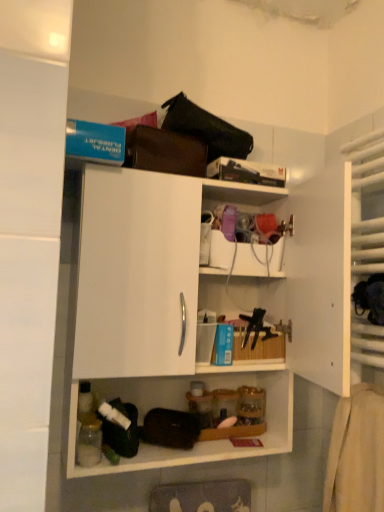
Locate an element on the screen. The image size is (384, 512). white matte cabinet at center, which is counted as the 1th shelf, starting from the left is located at coordinates (156, 304).

Describe the element at coordinates (156, 304) in the screenshot. I see `white matte cabinet at center, which is counted as the 1th shelf, starting from the left` at that location.

Image resolution: width=384 pixels, height=512 pixels. In order to click on translucent plastic container at upper center, which is counted as the first shelf, starting from the right in this screenshot , I will do `click(247, 256)`.

What do you see at coordinates (247, 256) in the screenshot? I see `translucent plastic container at upper center, which is counted as the first shelf, starting from the right` at bounding box center [247, 256].

Locate an element on the screen. The image size is (384, 512). white matte cabinet at center, which is counted as the 1th shelf, starting from the left is located at coordinates (156, 304).

Considering the relative positions of translucent plastic container at upper center, which is counted as the first shelf, starting from the right, and white matte cabinet at center, which is counted as the 1th shelf, starting from the left, in the image provided, is translucent plastic container at upper center, which is counted as the first shelf, starting from the right, to the left of white matte cabinet at center, which is counted as the 1th shelf, starting from the left, from the viewer's perspective?

No.

Relative to white matte cabinet at center, which is counted as the 2th shelf, starting from the right, is translucent plastic container at upper center, which is counted as the first shelf, starting from the right, in front or behind?

translucent plastic container at upper center, which is counted as the first shelf, starting from the right, is behind white matte cabinet at center, which is counted as the 2th shelf, starting from the right.

Which point is more forward, (219, 261) or (165, 271)?

The point (165, 271) is more forward.

From the image's perspective, who appears lower, translucent plastic container at upper center, which is counted as the first shelf, starting from the right, or white matte cabinet at center, which is counted as the 1th shelf, starting from the left?

white matte cabinet at center, which is counted as the 1th shelf, starting from the left, is shown below in the image.

From a real-world perspective, is translucent plastic container at upper center, positioned as the second shelf in left-to-right order, physically below white matte cabinet at center, which is counted as the 1th shelf, starting from the left?

Actually, translucent plastic container at upper center, positioned as the second shelf in left-to-right order, is physically above white matte cabinet at center, which is counted as the 1th shelf, starting from the left, in the real world.

Which of these two, translucent plastic container at upper center, which is counted as the first shelf, starting from the right, or white matte cabinet at center, which is counted as the 2th shelf, starting from the right, is thinner?

With smaller width is translucent plastic container at upper center, which is counted as the first shelf, starting from the right.

In terms of height, does translucent plastic container at upper center, which is counted as the first shelf, starting from the right, look taller or shorter compared to white matte cabinet at center, which is counted as the 1th shelf, starting from the left?

In the image, translucent plastic container at upper center, which is counted as the first shelf, starting from the right, appears to be shorter than white matte cabinet at center, which is counted as the 1th shelf, starting from the left.

Considering the relative sizes of translucent plastic container at upper center, which is counted as the first shelf, starting from the right, and white matte cabinet at center, which is counted as the 2th shelf, starting from the right, in the image provided, is translucent plastic container at upper center, which is counted as the first shelf, starting from the right, bigger than white matte cabinet at center, which is counted as the 2th shelf, starting from the right,?

Incorrect, translucent plastic container at upper center, which is counted as the first shelf, starting from the right, is not larger than white matte cabinet at center, which is counted as the 2th shelf, starting from the right.

Choose the correct answer: Is translucent plastic container at upper center, which is counted as the first shelf, starting from the right, inside white matte cabinet at center, which is counted as the 1th shelf, starting from the left, or outside it?

translucent plastic container at upper center, which is counted as the first shelf, starting from the right, is spatially positioned inside white matte cabinet at center, which is counted as the 1th shelf, starting from the left.

Is translucent plastic container at upper center, positioned as the second shelf in left-to-right order, in contact with white matte cabinet at center, which is counted as the 2th shelf, starting from the right?

translucent plastic container at upper center, positioned as the second shelf in left-to-right order, is not next to white matte cabinet at center, which is counted as the 2th shelf, starting from the right, and they're not touching.

Could you tell me if translucent plastic container at upper center, positioned as the second shelf in left-to-right order, is facing white matte cabinet at center, which is counted as the 2th shelf, starting from the right?

Yes, translucent plastic container at upper center, positioned as the second shelf in left-to-right order, is facing white matte cabinet at center, which is counted as the 2th shelf, starting from the right.

You are a GUI agent. You are given a task and a screenshot of the screen. Output one action in this format:
    pyautogui.click(x=<x>, y=<y>)
    Task: Click on the shelf below the translucent plastic container at upper center, which is counted as the first shelf, starting from the right (from the image's perspective)
    The height and width of the screenshot is (512, 384).
    Given the screenshot: What is the action you would take?
    pyautogui.click(x=156, y=304)

Which object is positioned more to the right, white matte cabinet at center, which is counted as the 1th shelf, starting from the left, or translucent plastic container at upper center, positioned as the second shelf in left-to-right order?

translucent plastic container at upper center, positioned as the second shelf in left-to-right order, is more to the right.

Considering the positions of objects white matte cabinet at center, which is counted as the 2th shelf, starting from the right, and translucent plastic container at upper center, positioned as the second shelf in left-to-right order, in the image provided, who is behind, white matte cabinet at center, which is counted as the 2th shelf, starting from the right, or translucent plastic container at upper center, positioned as the second shelf in left-to-right order,?

Positioned behind is translucent plastic container at upper center, positioned as the second shelf in left-to-right order.

Based on the photo, which point is more distant from viewer, (167, 285) or (258, 190)?

Point (258, 190)

From the image's perspective, is white matte cabinet at center, which is counted as the 2th shelf, starting from the right, over translucent plastic container at upper center, positioned as the second shelf in left-to-right order?

No, from the image's perspective, white matte cabinet at center, which is counted as the 2th shelf, starting from the right, is not on top of translucent plastic container at upper center, positioned as the second shelf in left-to-right order.

From a real-world perspective, which is physically above, white matte cabinet at center, which is counted as the 2th shelf, starting from the right, or translucent plastic container at upper center, positioned as the second shelf in left-to-right order?

translucent plastic container at upper center, positioned as the second shelf in left-to-right order, from a real-world perspective.

Looking at this image, between white matte cabinet at center, which is counted as the 2th shelf, starting from the right, and translucent plastic container at upper center, positioned as the second shelf in left-to-right order, which one has smaller width?

Thinner between the two is translucent plastic container at upper center, positioned as the second shelf in left-to-right order.

Is white matte cabinet at center, which is counted as the 2th shelf, starting from the right, shorter than translucent plastic container at upper center, which is counted as the first shelf, starting from the right?

Incorrect, the height of white matte cabinet at center, which is counted as the 2th shelf, starting from the right, does not fall short of that of translucent plastic container at upper center, which is counted as the first shelf, starting from the right.

Between white matte cabinet at center, which is counted as the 1th shelf, starting from the left, and translucent plastic container at upper center, positioned as the second shelf in left-to-right order, which one has larger size?

Bigger between the two is white matte cabinet at center, which is counted as the 1th shelf, starting from the left.

Which is correct: white matte cabinet at center, which is counted as the 1th shelf, starting from the left, is inside translucent plastic container at upper center, positioned as the second shelf in left-to-right order, or outside of it?

white matte cabinet at center, which is counted as the 1th shelf, starting from the left, is spatially situated outside translucent plastic container at upper center, positioned as the second shelf in left-to-right order.

Is white matte cabinet at center, which is counted as the 2th shelf, starting from the right, next to translucent plastic container at upper center, which is counted as the first shelf, starting from the right, and touching it?

No, white matte cabinet at center, which is counted as the 2th shelf, starting from the right, is not making contact with translucent plastic container at upper center, which is counted as the first shelf, starting from the right.

Is translucent plastic container at upper center, which is counted as the first shelf, starting from the right, at the back of white matte cabinet at center, which is counted as the 1th shelf, starting from the left?

Correct, white matte cabinet at center, which is counted as the 1th shelf, starting from the left, is looking away from translucent plastic container at upper center, which is counted as the first shelf, starting from the right.

Locate an element on the screen. This screenshot has height=512, width=384. shelf below the translucent plastic container at upper center, which is counted as the first shelf, starting from the right (from a real-world perspective) is located at coordinates (156, 304).

The width and height of the screenshot is (384, 512). Identify the location of shelf that appears above the white matte cabinet at center, which is counted as the 1th shelf, starting from the left (from a real-world perspective). (247, 256).

The height and width of the screenshot is (512, 384). I want to click on shelf below the translucent plastic container at upper center, positioned as the second shelf in left-to-right order (from a real-world perspective), so click(x=156, y=304).